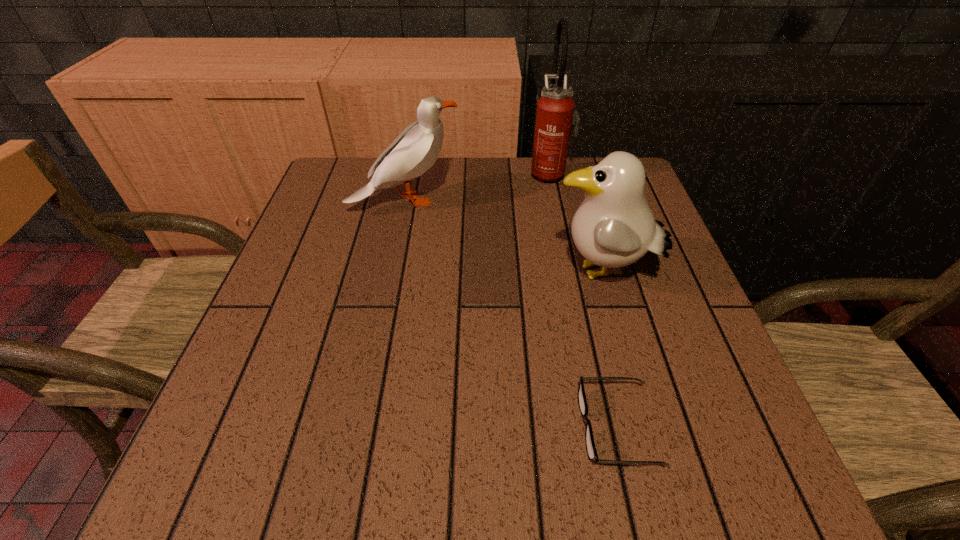
You are a GUI agent. You are given a task and a screenshot of the screen. Output one action in this format:
    pyautogui.click(x=<x>, y=<y>)
    Task: Click on the blank area located 0.400m on the beak of the nearer gull
    
    Given the screenshot: What is the action you would take?
    pyautogui.click(x=352, y=274)

Where is `vacant space located 0.120m on the beak of the nearer gull`? The width and height of the screenshot is (960, 540). vacant space located 0.120m on the beak of the nearer gull is located at coordinates (490, 274).

What are the coordinates of `vacant space situated on the beak of the nearer gull` in the screenshot? It's located at (416, 274).

Locate an element on the screen. This screenshot has height=540, width=960. free space located 0.330m at the beak of the farther gull is located at coordinates (594, 201).

The image size is (960, 540). What are the coordinates of `free spot located on the front-facing side of the spectacles` in the screenshot? It's located at (494, 427).

At what (x,y) coordinates should I click in order to perform the action: click on vacant space located on the front-facing side of the spectacles. Please return your answer as a coordinate pair (x, y). Looking at the image, I should click on (402, 427).

The image size is (960, 540). Identify the location of vacant space located on the front-facing side of the spectacles. (362, 427).

You are a GUI agent. You are given a task and a screenshot of the screen. Output one action in this format:
    pyautogui.click(x=<x>, y=<y>)
    Task: Click on the fire extinguisher that is at the far edge
    
    Given the screenshot: What is the action you would take?
    pyautogui.click(x=555, y=115)

The width and height of the screenshot is (960, 540). In order to click on gull situated at the far edge in this screenshot , I will do `click(415, 150)`.

Locate an element on the screen. The width and height of the screenshot is (960, 540). object that is at the near edge is located at coordinates point(592,454).